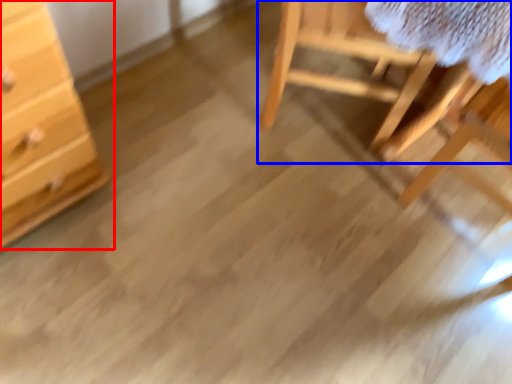
Question: Which object appears closest to the camera in this image, chest of drawers (highlighted by a red box) or furniture (highlighted by a blue box)?

Choices:
 (A) chest of drawers
 (B) furniture

Answer: (A)